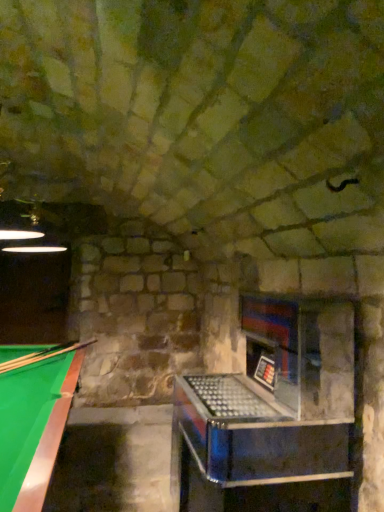
Question: Does wooden smooth cue at left have a lesser width compared to green felt billiard table at lower left?

Choices:
 (A) yes
 (B) no

Answer: (B)

Question: Is wooden smooth cue at left positioned with its back to green felt billiard table at lower left?

Choices:
 (A) yes
 (B) no

Answer: (A)

Question: From the image's perspective, is wooden smooth cue at left under green felt billiard table at lower left?

Choices:
 (A) yes
 (B) no

Answer: (B)

Question: From the image's perspective, is wooden smooth cue at left above green felt billiard table at lower left?

Choices:
 (A) no
 (B) yes

Answer: (B)

Question: Would you say wooden smooth cue at left is outside green felt billiard table at lower left?

Choices:
 (A) yes
 (B) no

Answer: (B)

Question: Does wooden smooth cue at left have a smaller size compared to green felt billiard table at lower left?

Choices:
 (A) no
 (B) yes

Answer: (B)

Question: Is green felt billiard table at lower left not within wooden smooth cue at left?

Choices:
 (A) yes
 (B) no

Answer: (A)

Question: Considering the relative sizes of green felt billiard table at lower left and wooden smooth cue at left in the image provided, is green felt billiard table at lower left wider than wooden smooth cue at left?

Choices:
 (A) no
 (B) yes

Answer: (A)

Question: Is green felt billiard table at lower left positioned behind wooden smooth cue at left?

Choices:
 (A) no
 (B) yes

Answer: (A)

Question: Is green felt billiard table at lower left surrounding wooden smooth cue at left?

Choices:
 (A) yes
 (B) no

Answer: (A)

Question: Does green felt billiard table at lower left have a smaller size compared to wooden smooth cue at left?

Choices:
 (A) no
 (B) yes

Answer: (A)

Question: Does green felt billiard table at lower left have a lesser width compared to wooden smooth cue at left?

Choices:
 (A) yes
 (B) no

Answer: (A)

Question: Which is correct: green felt billiard table at lower left is inside wooden smooth cue at left, or outside of it?

Choices:
 (A) inside
 (B) outside

Answer: (B)